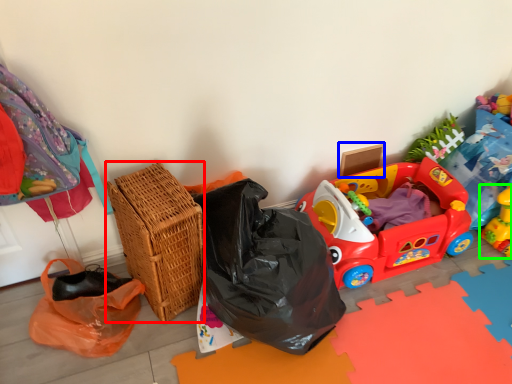
Question: Which object is positioned closest to basket (highlighted by a red box)? Select from cardboard box (highlighted by a blue box) and toy (highlighted by a green box).

Choices:
 (A) cardboard box
 (B) toy

Answer: (A)